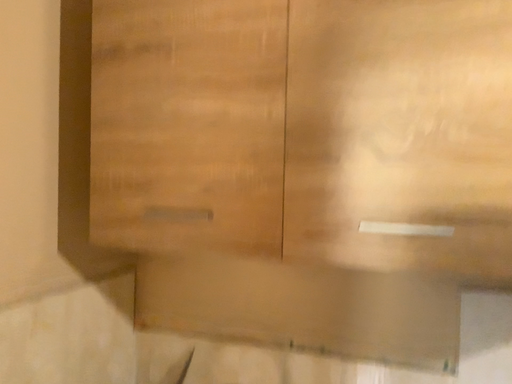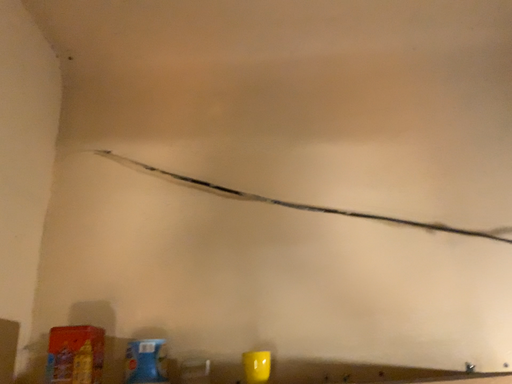
Question: Which way did the camera rotate in the video?

Choices:
 (A) rotated downward
 (B) rotated upward

Answer: (B)